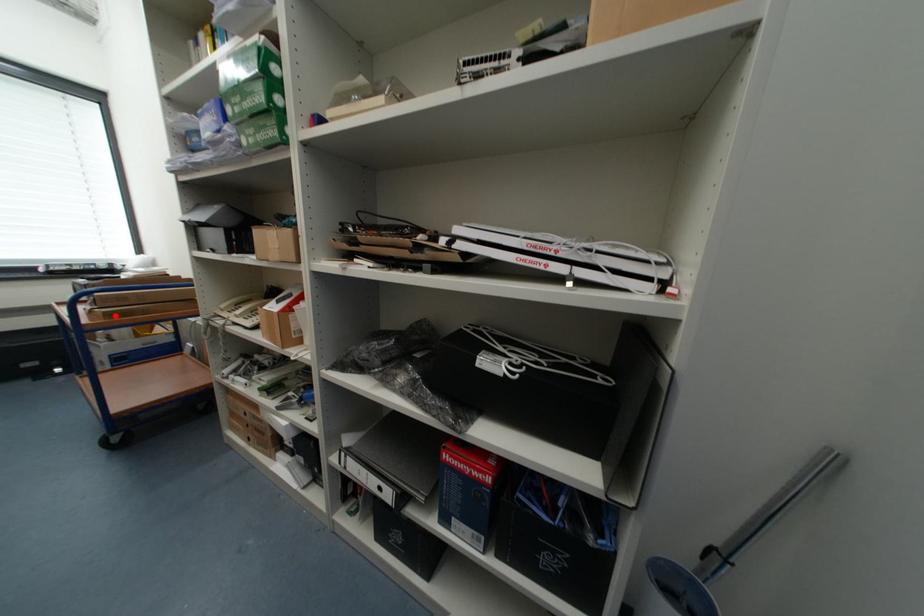
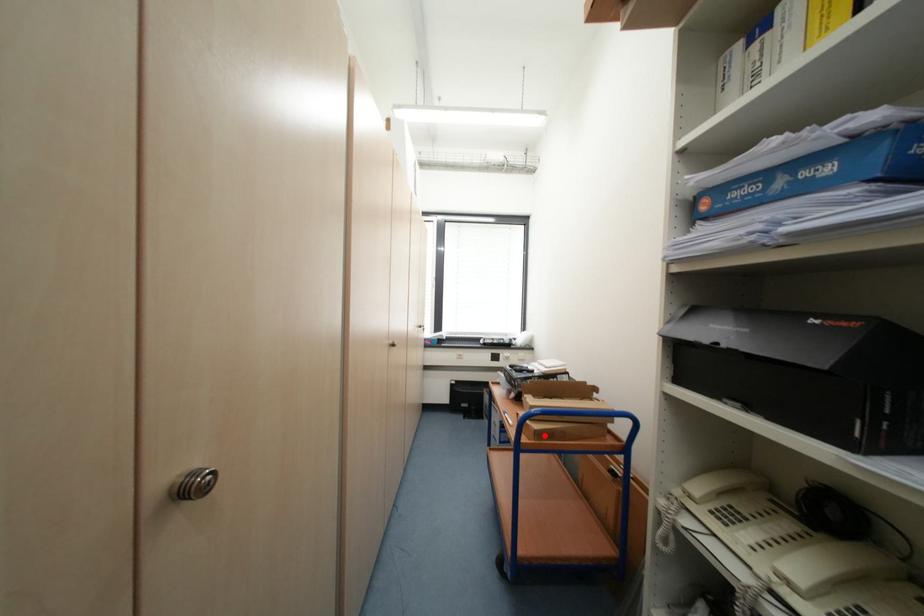
I am providing you with two images of the same scene from different viewpoints. A red point is marked on the first image and another point is marked on the second image. Does the point marked in image1 correspond to the same location as the one in image2?

Yes